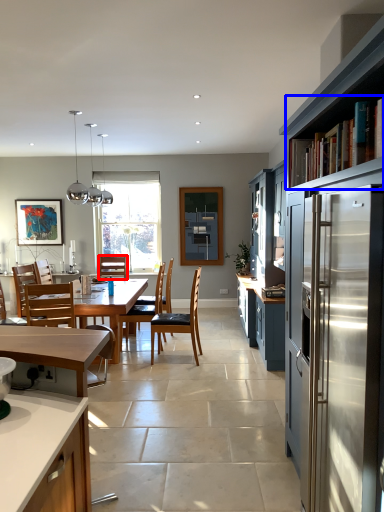
Question: Among these objects, which one is farthest to the camera, chair (highlighted by a red box) or shelf (highlighted by a blue box)?

Choices:
 (A) chair
 (B) shelf

Answer: (A)